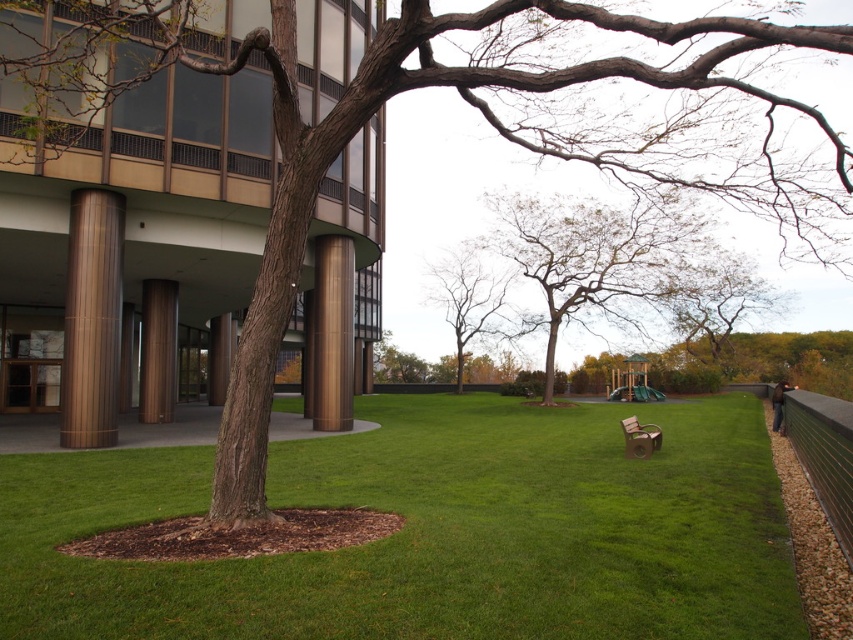
You are standing in the outdoor scene and want to sit down. There is a green grass at center and a wooden park bench at lower right. Which one is closer to you so you can reach it faster?

The green grass at center is closer to the viewer than the wooden park bench at lower right, so you can reach it faster.

You are a gardener planning to water the brown textured tree at upper right and the green textured fence at right. Since the tree is positioned to the right of the fence, which direction should you move from the fence to reach the tree?

The brown textured tree at upper right is to the right of the green textured fence at right, so you should move to the right from the fence to reach the tree.